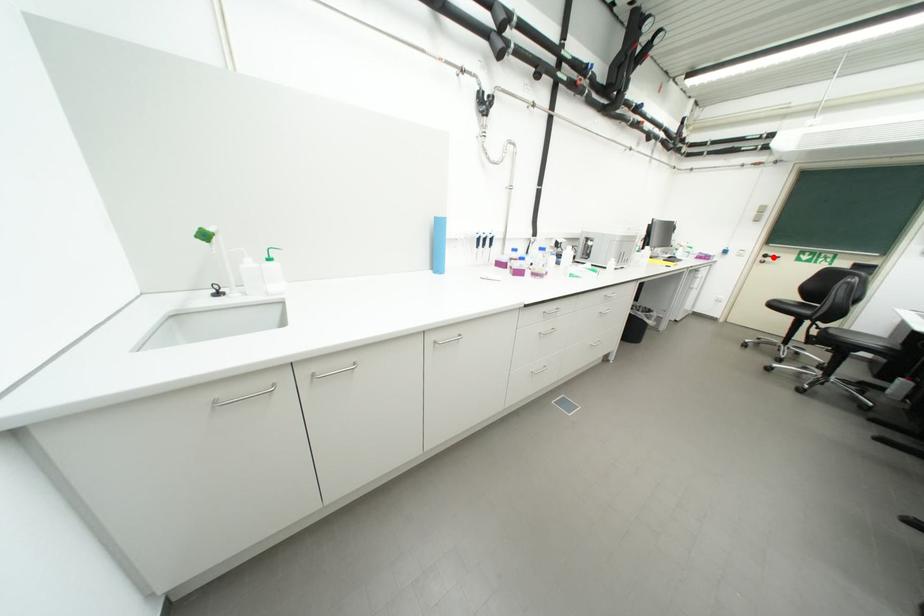
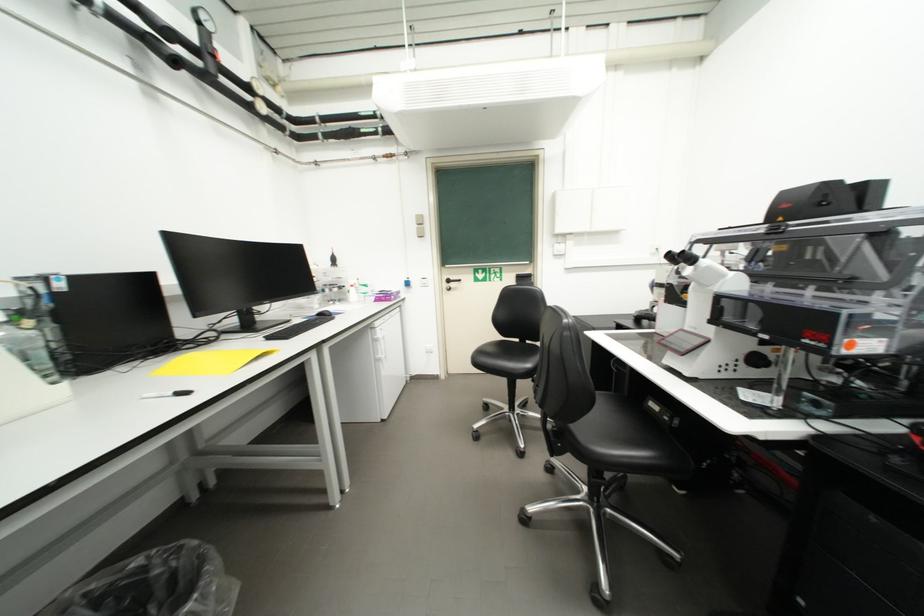
Find the pixel in the second image that matches the highlighted location in the first image.

(456, 283)